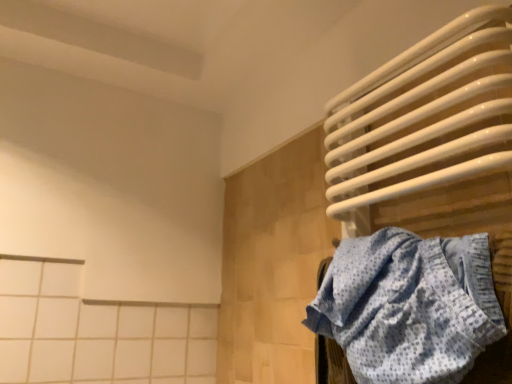
Question: Considering the positions of blue dotted fabric at right and white glossy towel rack at upper right in the image, is blue dotted fabric at right bigger or smaller than white glossy towel rack at upper right?

Choices:
 (A) big
 (B) small

Answer: (B)

Question: Do you think blue dotted fabric at right is within white glossy towel rack at upper right, or outside of it?

Choices:
 (A) outside
 (B) inside

Answer: (B)

Question: In terms of height, does blue dotted fabric at right look taller or shorter compared to white glossy towel rack at upper right?

Choices:
 (A) tall
 (B) short

Answer: (B)

Question: Relative to blue dotted fabric at right, is white glossy towel rack at upper right in front or behind?

Choices:
 (A) front
 (B) behind

Answer: (B)

Question: Is white glossy towel rack at upper right inside or outside of blue dotted fabric at right?

Choices:
 (A) outside
 (B) inside

Answer: (A)

Question: From a real-world perspective, is white glossy towel rack at upper right positioned above or below blue dotted fabric at right?

Choices:
 (A) above
 (B) below

Answer: (A)

Question: Is point (392, 140) positioned closer to the camera than point (412, 289)?

Choices:
 (A) closer
 (B) farther

Answer: (B)